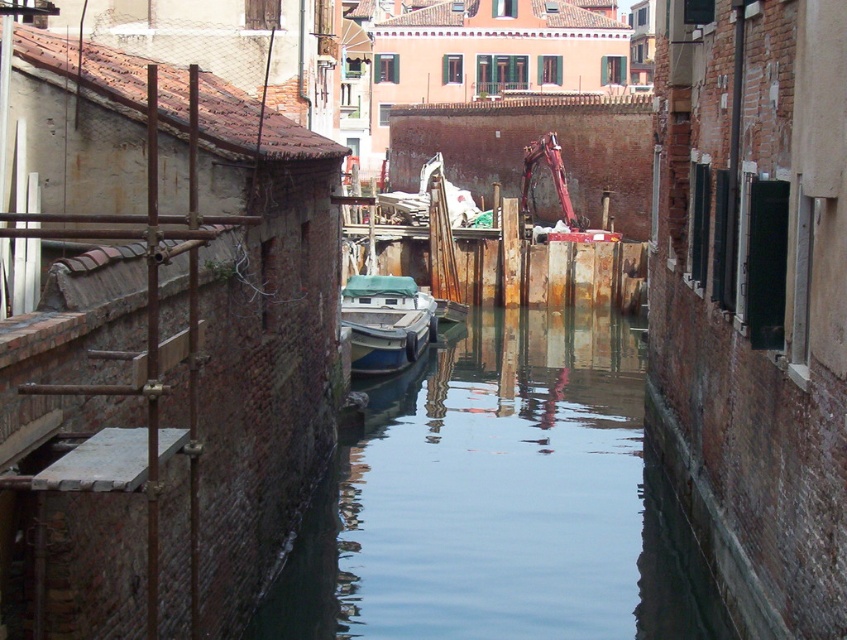
Question: Which point is farther from the camera taking this photo?

Choices:
 (A) (740, 387)
 (B) (507, 365)
 (C) (408, 280)

Answer: (C)

Question: Among these objects, which one is farthest from the camera?

Choices:
 (A) blue matte boat at center
 (B) clear water at center

Answer: (A)

Question: Can you confirm if brick wall at center is thinner than blue matte boat at center?

Choices:
 (A) yes
 (B) no

Answer: (A)

Question: Which object is positioned closest to the clear water at center?

Choices:
 (A) brick wall at center
 (B) blue matte boat at center

Answer: (B)

Question: In this image, where is brick wall at center located relative to blue matte boat at center?

Choices:
 (A) below
 (B) above

Answer: (B)

Question: Is brick wall at center positioned at the back of clear water at center?

Choices:
 (A) yes
 (B) no

Answer: (B)